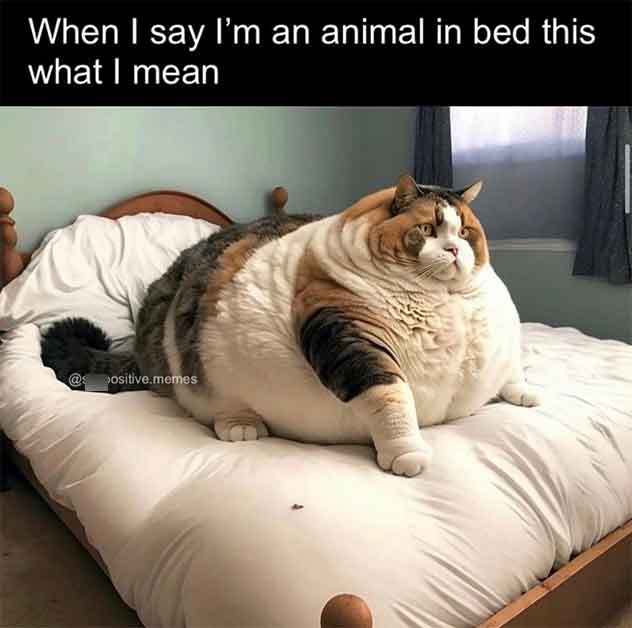
You are a GUI agent. You are given a task and a screenshot of the screen. Output one action in this format:
    pyautogui.click(x=<x>, y=<y>)
    Task: Click on the floor
    
    Given the screenshot: What is the action you would take?
    pyautogui.click(x=621, y=619), pyautogui.click(x=61, y=581)